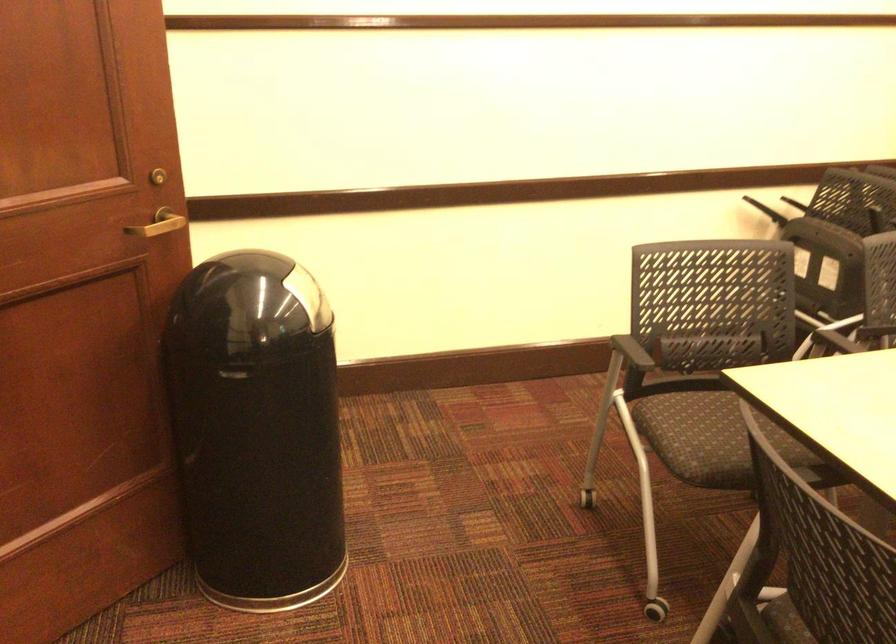
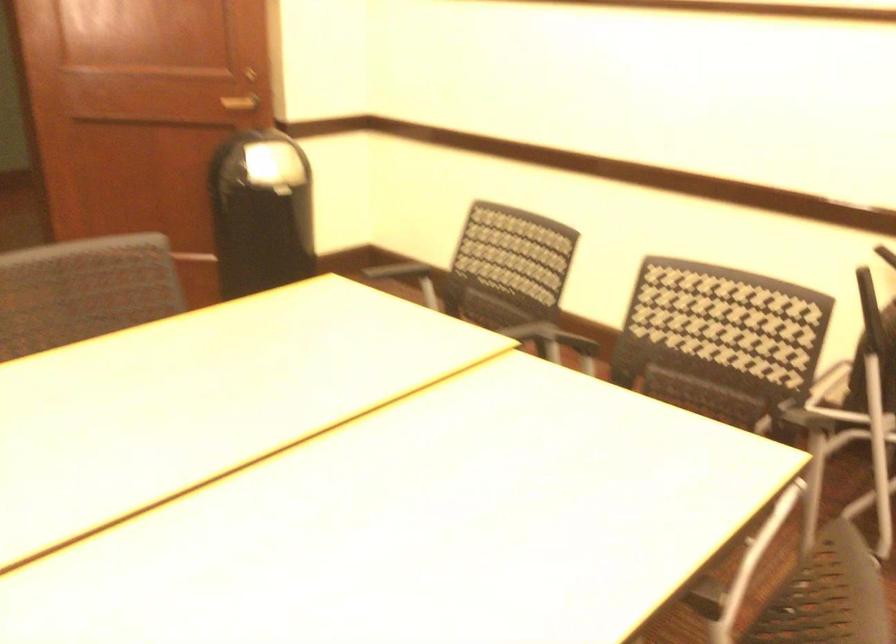
Locate, in the second image, the point that corresponds to (183,254) in the first image.

(240, 102)